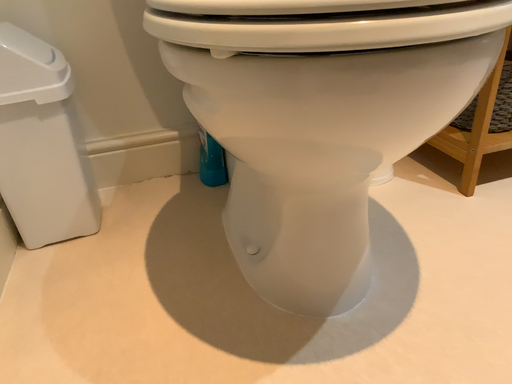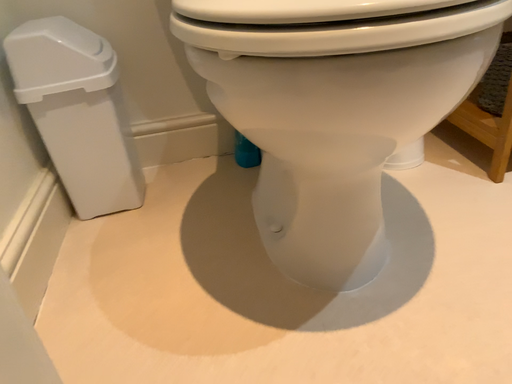
Question: How did the camera likely rotate when shooting the video?

Choices:
 (A) rotated left
 (B) rotated right

Answer: (A)